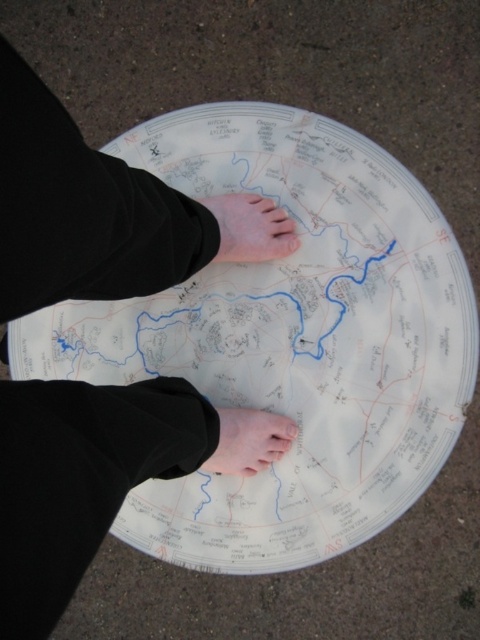
Based on the provided scene, where exactly is the light skin barefoot at center located in terms of coordinates?

The light skin barefoot at center is located at the 2D coordinates of point (251, 228).

You are standing on the circular map and see the point marked as point (287,340). Is this point located closer to the center of the map or the edge?

The point (287,340) is located at the center of the map, so it is closer to the center than the edge.

You are holding a small drone that can fly up to 2 meters high. You want to take a photo of the white paper plate at center from above. Can your drone reach the plate?

The distance between the white paper plate at center and the camera is 1.58 meters. Since the drone can fly up to 2 meters, it can reach the plate and take the photo.